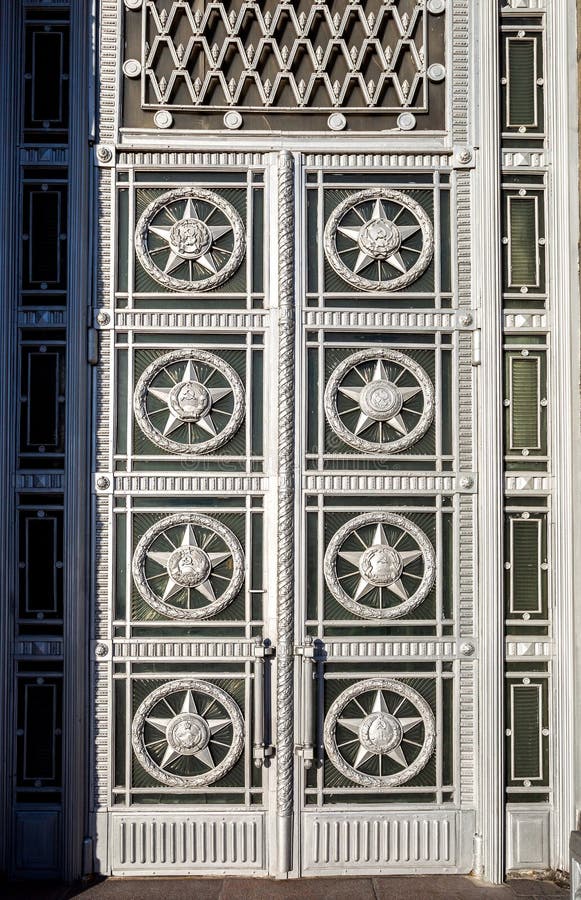
The width and height of the screenshot is (581, 900). What are the coordinates of `the top left hinge` in the screenshot? It's located at (95, 340).